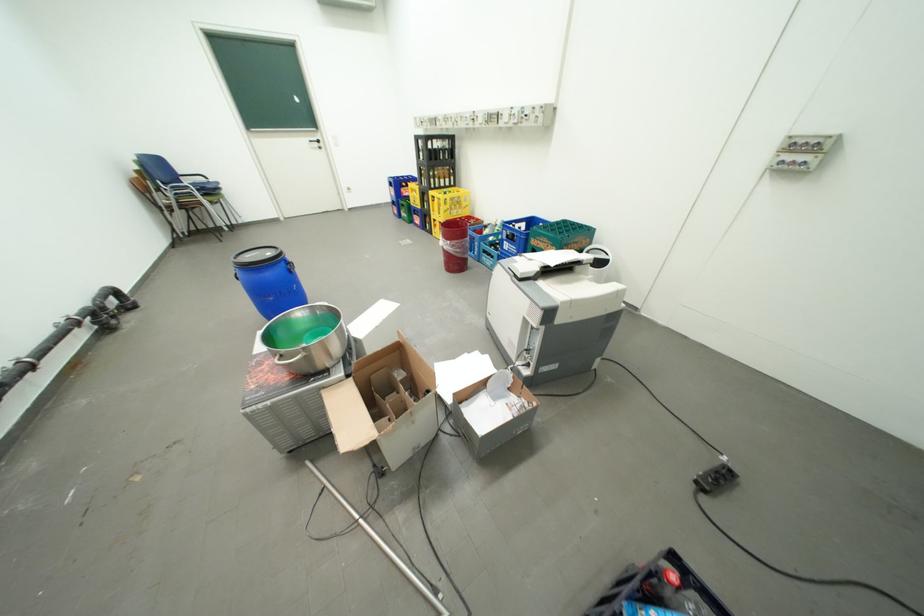
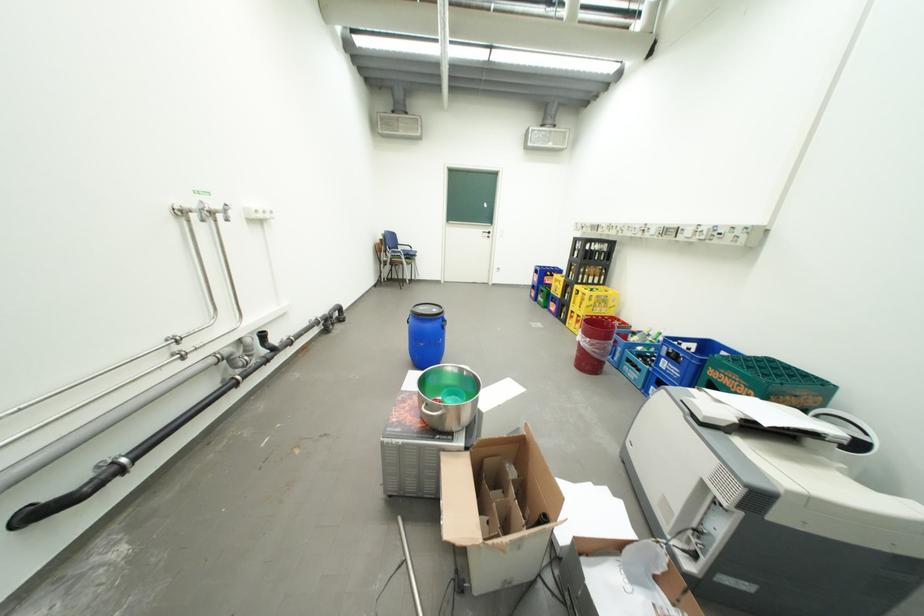
Where in the second image is the point corresponding to (x=562, y=246) from the first image?

(756, 387)